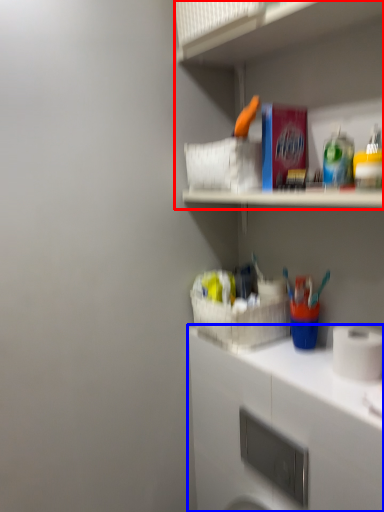
Question: Among these objects, which one is farthest to the camera, shelf (highlighted by a red box) or cabinetry (highlighted by a blue box)?

Choices:
 (A) shelf
 (B) cabinetry

Answer: (B)